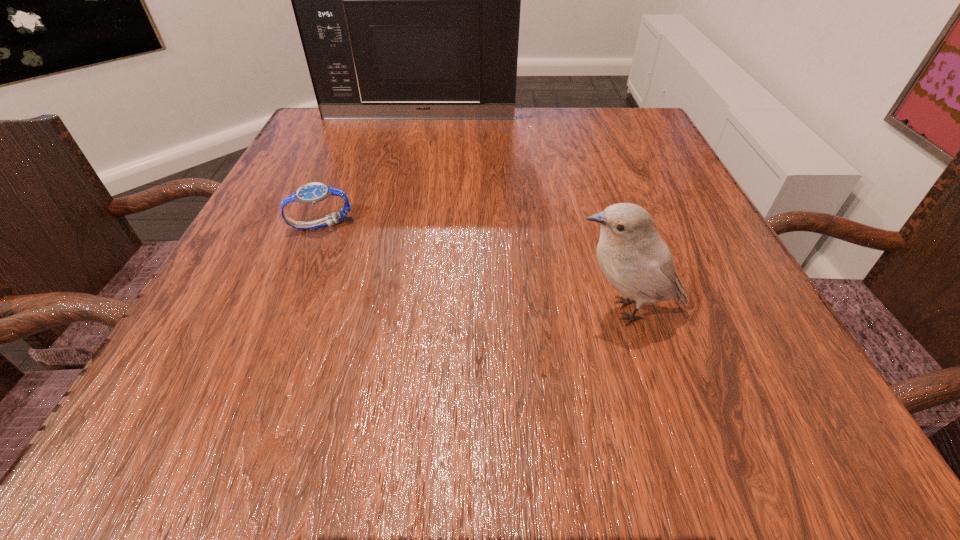
Find the location of a particular element. This screenshot has height=540, width=960. the farthest object is located at coordinates (407, 0).

Identify the location of microwave oven. Image resolution: width=960 pixels, height=540 pixels. pyautogui.click(x=407, y=0).

The height and width of the screenshot is (540, 960). What are the coordinates of `bird` in the screenshot? It's located at (637, 262).

The width and height of the screenshot is (960, 540). In order to click on the second shortest object in this screenshot , I will do `click(637, 262)`.

Where is `the second farthest object`? This screenshot has width=960, height=540. the second farthest object is located at coordinates (311, 193).

Image resolution: width=960 pixels, height=540 pixels. I want to click on the shortest object, so click(x=311, y=193).

Where is `vacant space located 0.370m on the front panel of the microwave oven`? This screenshot has height=540, width=960. vacant space located 0.370m on the front panel of the microwave oven is located at coordinates point(396,216).

Where is `blank area located 0.140m at the beak of the bird`? This screenshot has width=960, height=540. blank area located 0.140m at the beak of the bird is located at coordinates (467, 310).

Locate an element on the screen. The width and height of the screenshot is (960, 540). blank area located 0.290m at the beak of the bird is located at coordinates (359, 310).

Where is `vacant space located at the beak of the bird`? vacant space located at the beak of the bird is located at coordinates (417, 310).